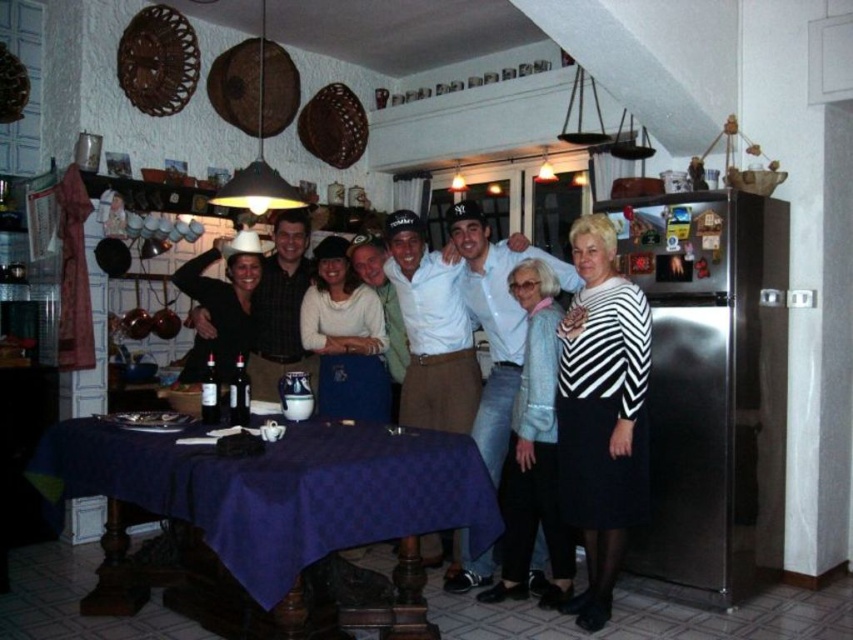
Question: Is matte white shirt at center below striped fabric sweater at right?

Choices:
 (A) yes
 (B) no

Answer: (B)

Question: Which object is closer to the camera taking this photo?

Choices:
 (A) matte white sweater at center
 (B) matte white shirt at center
 (C) matte black cowboy hat at left
 (D) purple fabric-covered table at center

Answer: (D)

Question: Does purple fabric-covered table at center appear on the right side of light blue textured sweater at right?

Choices:
 (A) no
 (B) yes

Answer: (A)

Question: Among these objects, which one is farthest from the camera?

Choices:
 (A) matte black cowboy hat at left
 (B) striped fabric sweater at right
 (C) matte white shirt at center
 (D) light blue textured sweater at right

Answer: (A)

Question: Based on their relative distances, which object is nearer to the striped fabric sweater at right?

Choices:
 (A) matte black cowboy hat at left
 (B) matte white shirt at center
 (C) purple fabric-covered table at center
 (D) light blue textured sweater at right

Answer: (B)

Question: Does purple fabric-covered table at center appear on the left side of striped fabric sweater at right?

Choices:
 (A) no
 (B) yes

Answer: (B)